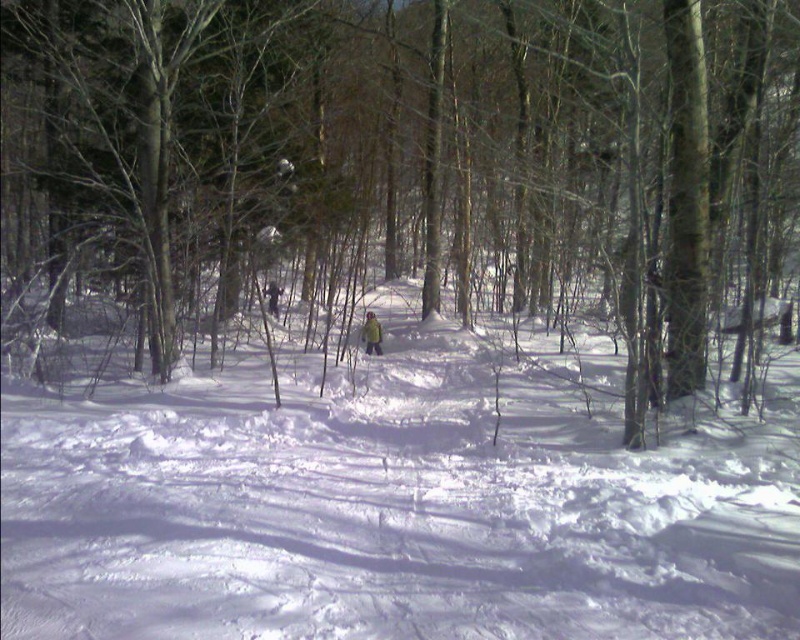
Question: Where is white fluffy snow at center located in relation to green fabric person at center in the image?

Choices:
 (A) above
 (B) below

Answer: (B)

Question: Where is white fluffy snow at center located in relation to green fabric person at center in the image?

Choices:
 (A) above
 (B) below

Answer: (B)

Question: Is white fluffy snow at center wider than green fabric person at center?

Choices:
 (A) yes
 (B) no

Answer: (A)

Question: Which point is closer to the camera taking this photo?

Choices:
 (A) (46, 116)
 (B) (366, 320)

Answer: (A)

Question: Which object is farther from the camera taking this photo?

Choices:
 (A) white fluffy snow at center
 (B) green fabric person at center
 (C) brown smooth tree at center

Answer: (B)

Question: Among these objects, which one is farthest from the camera?

Choices:
 (A) green fabric person at center
 (B) white fluffy snow at center
 (C) brown smooth tree at center

Answer: (A)